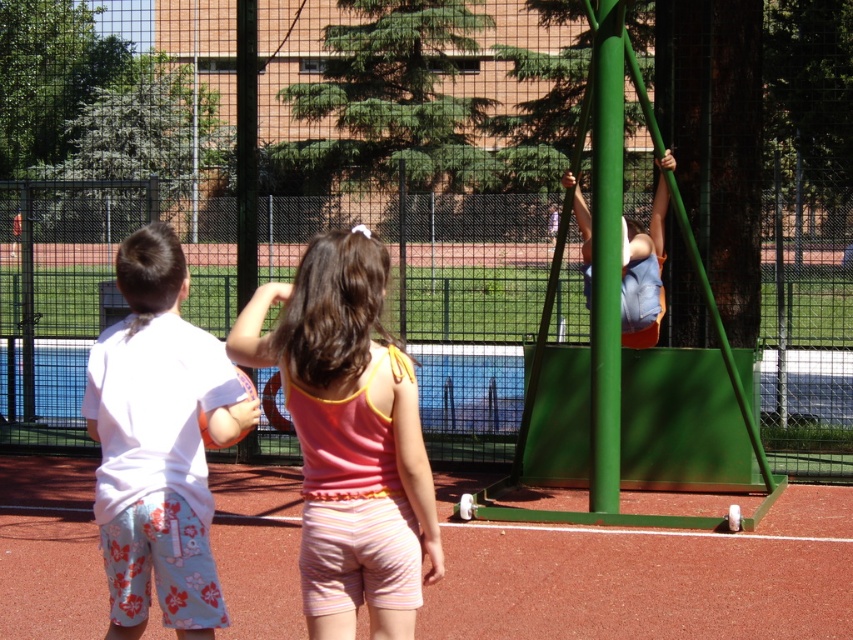
Can you confirm if white cotton shirt at left is bigger than green matte pole at center?

Yes, white cotton shirt at left is bigger than green matte pole at center.

Can you confirm if white cotton shirt at left is smaller than green matte pole at center?

No.

Is point (164, 566) behind point (605, 348)?

That is False.

Where is `white cotton shirt at left`? This screenshot has width=853, height=640. white cotton shirt at left is located at coordinates (158, 444).

Who is more distant from viewer, (604, 248) or (646, 301)?

The point (646, 301) is behind.

The height and width of the screenshot is (640, 853). Describe the element at coordinates (605, 259) in the screenshot. I see `green matte pole at center` at that location.

Identify the location of green matte pole at center. This screenshot has height=640, width=853. (605, 259).

Does pink fabric tank top at center have a greater height compared to green matte pole at center?

No, pink fabric tank top at center is not taller than green matte pole at center.

Is pink fabric tank top at center further to camera compared to green matte pole at center?

No, pink fabric tank top at center is closer to the viewer.

The height and width of the screenshot is (640, 853). Describe the element at coordinates (349, 435) in the screenshot. I see `pink fabric tank top at center` at that location.

Where is `pink fabric tank top at center`? pink fabric tank top at center is located at coordinates (349, 435).